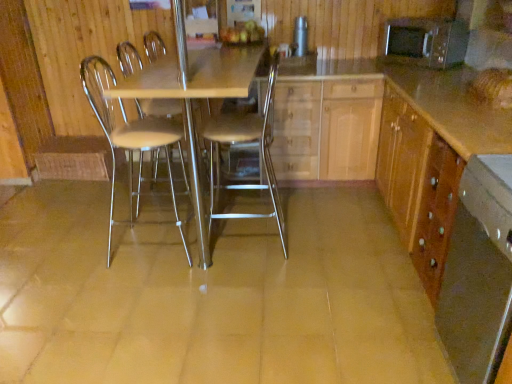
I want to click on vacant space underneath metallic silver chair at center, which appears as the 1th chair when viewed from the left (from a real-world perspective), so click(142, 246).